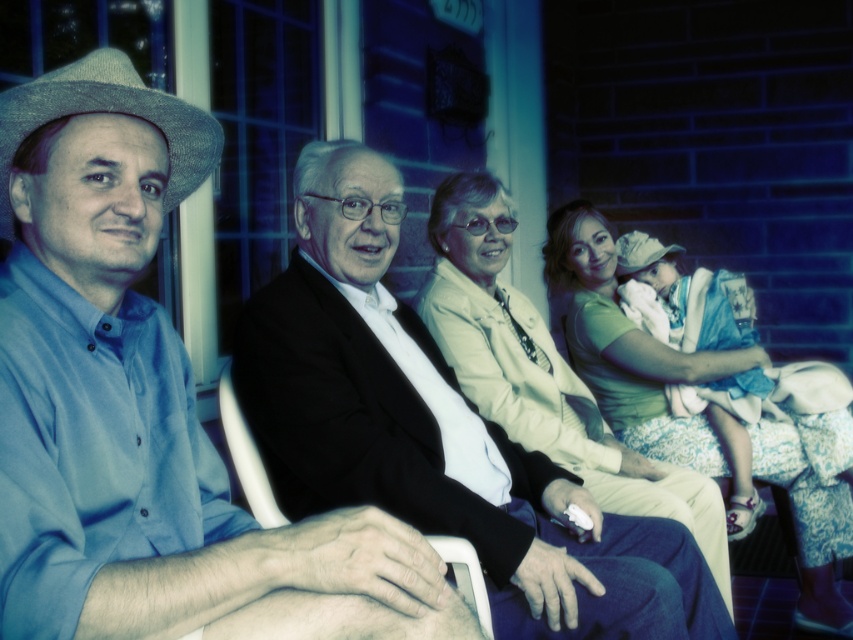
How much distance is there between light beige fabric jacket at center and matte green shirt at right?

light beige fabric jacket at center and matte green shirt at right are 52.25 centimeters apart.

Which is in front, point (672, 508) or point (805, 618)?

Point (672, 508) is in front.

What do you see at coordinates (558, 396) in the screenshot? The image size is (853, 640). I see `light beige fabric jacket at center` at bounding box center [558, 396].

I want to click on light beige fabric jacket at center, so click(558, 396).

Does light beige fabric jacket at center appear over white plastic chair at center?

Indeed, light beige fabric jacket at center is positioned over white plastic chair at center.

Measure the distance between light beige fabric jacket at center and white plastic chair at center.

A distance of 84.87 centimeters exists between light beige fabric jacket at center and white plastic chair at center.

I want to click on light beige fabric jacket at center, so click(558, 396).

Who is lower down, blue cotton shirt at left or light beige fabric jacket at center?

light beige fabric jacket at center is lower down.

Measure the distance between blue cotton shirt at left and light beige fabric jacket at center.

blue cotton shirt at left is 38.03 inches from light beige fabric jacket at center.

Does point (125, 182) come behind point (508, 292)?

That is False.

The height and width of the screenshot is (640, 853). Find the location of `blue cotton shirt at left`. blue cotton shirt at left is located at coordinates (149, 412).